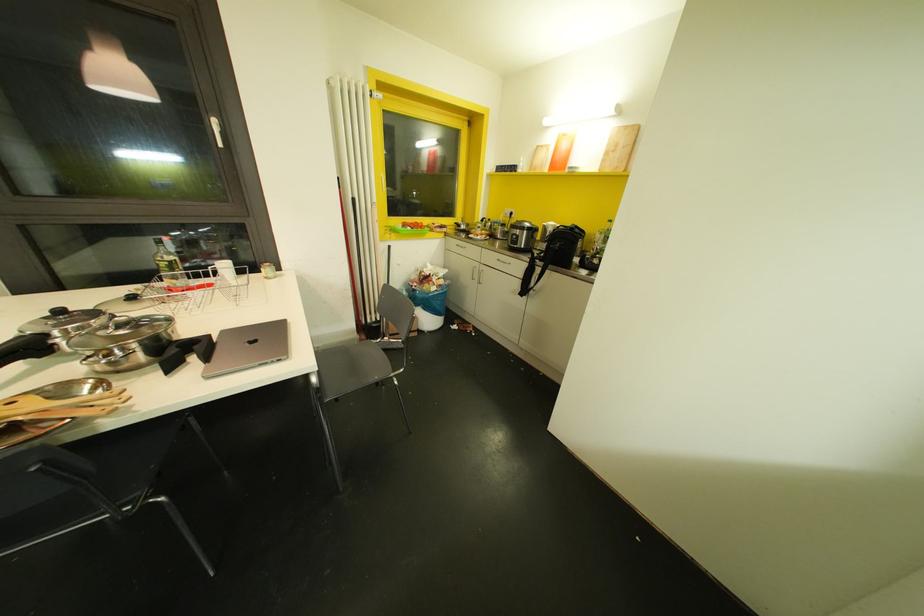
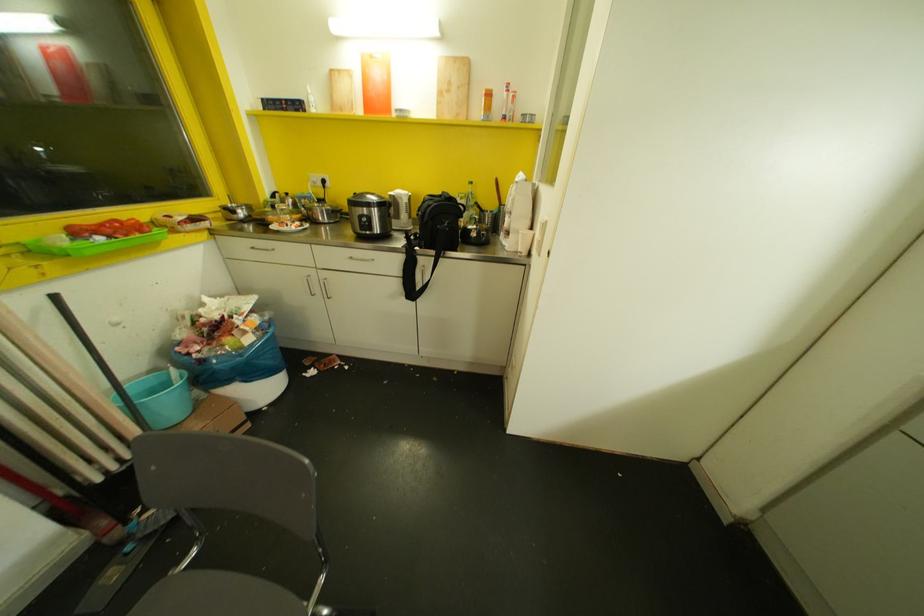
Question: I am providing you with two images of the same scene from different viewpoints. Which of the following objects are not visible in image2?

Choices:
 (A) green plastic tray
 (B) white kettle handle
 (C) black bag strap
 (D) none of these

Answer: (D)